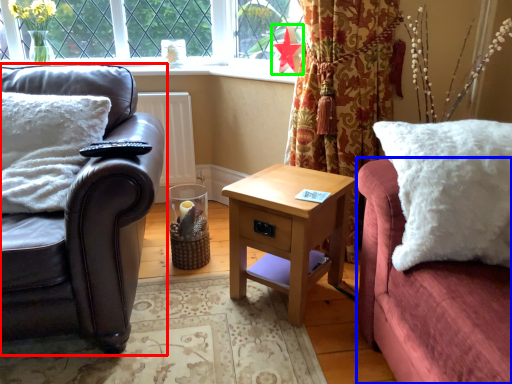
Question: Which object is the farthest from studio couch (highlighted by a red box)? Choose among these: couch (highlighted by a blue box) or flower (highlighted by a green box).

Choices:
 (A) couch
 (B) flower

Answer: (B)